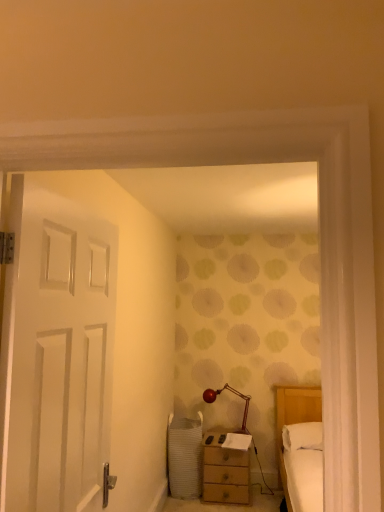
Where is `white matte door at left`? The height and width of the screenshot is (512, 384). white matte door at left is located at coordinates (57, 351).

The width and height of the screenshot is (384, 512). Identify the location of wooden nightstand at lower center. point(225,470).

The width and height of the screenshot is (384, 512). Find the location of `white soft pillow at right`. white soft pillow at right is located at coordinates click(302, 436).

Measure the distance between point [303,444] and camera.

A distance of 3.35 meters exists between point [303,444] and camera.

Where is `white matte door at left`? white matte door at left is located at coordinates (57, 351).

Who is bigger, wooden nightstand at lower center or white matte door at left?

wooden nightstand at lower center is bigger.

Which object is more forward, wooden nightstand at lower center or white matte door at left?

Positioned in front is white matte door at left.

Considering the sizes of objects wooden nightstand at lower center and white matte door at left in the image provided, who is taller, wooden nightstand at lower center or white matte door at left?

With more height is white matte door at left.

Which is closer, (206, 460) or (87, 246)?

Point (206, 460) appears to be farther away from the viewer than point (87, 246).

Is wooden nightstand at lower center to the left of shiny red glass table lamp at center from the viewer's perspective?

Correct, you'll find wooden nightstand at lower center to the left of shiny red glass table lamp at center.

Which is behind, point (212, 493) or point (208, 397)?

The point (208, 397) is farther.

In the scene shown: Does wooden nightstand at lower center have a greater height compared to shiny red glass table lamp at center?

Yes, wooden nightstand at lower center is taller than shiny red glass table lamp at center.

Are white soft pillow at right and white matte door at left making contact?

No, white soft pillow at right is not touching white matte door at left.

Consider the image. Visually, is white soft pillow at right positioned to the left or to the right of white matte door at left?

In the image, white soft pillow at right appears on the right side of white matte door at left.

The image size is (384, 512). I want to click on door that appears in front of the white soft pillow at right, so click(x=57, y=351).

From the image's perspective, between white matte door at left and shiny red glass table lamp at center, which one is located above?

white matte door at left is shown above in the image.

From a real-world perspective, who is located higher, white matte door at left or shiny red glass table lamp at center?

white matte door at left.

Which is in front, white matte door at left or shiny red glass table lamp at center?

white matte door at left is in front.

Is white matte door at left positioned far away from shiny red glass table lamp at center?

Yes.

From the image's perspective, which object appears higher, white soft pillow at right or wooden nightstand at lower center?

white soft pillow at right is shown above in the image.

From a real-world perspective, is white soft pillow at right physically above wooden nightstand at lower center?

Indeed, from a real-world perspective, white soft pillow at right stands above wooden nightstand at lower center.

Would you say wooden nightstand at lower center is part of white soft pillow at right's contents?

No, wooden nightstand at lower center is not inside white soft pillow at right.

Find the location of a particular element. Image resolution: width=384 pixels, height=512 pixels. nightstand below the white soft pillow at right (from a real-world perspective) is located at coordinates (225, 470).

Measure the distance from white matte door at left to wooden nightstand at lower center.

8.22 feet.

Does white matte door at left touch wooden nightstand at lower center?

No, white matte door at left is not making contact with wooden nightstand at lower center.

Is white matte door at left to the right of wooden nightstand at lower center from the viewer's perspective?

Incorrect, white matte door at left is not on the right side of wooden nightstand at lower center.

Considering the relative sizes of shiny red glass table lamp at center and wooden nightstand at lower center in the image provided, is shiny red glass table lamp at center taller than wooden nightstand at lower center?

No.

Looking at this image, is shiny red glass table lamp at center positioned with its back to wooden nightstand at lower center?

shiny red glass table lamp at center is not turned away from wooden nightstand at lower center.

Does shiny red glass table lamp at center appear on the right side of wooden nightstand at lower center?

Correct, you'll find shiny red glass table lamp at center to the right of wooden nightstand at lower center.

Is shiny red glass table lamp at center inside the boundaries of wooden nightstand at lower center, or outside?

shiny red glass table lamp at center lies outside wooden nightstand at lower center.

This screenshot has height=512, width=384. I want to click on nightstand on the right of white matte door at left, so click(x=225, y=470).

The width and height of the screenshot is (384, 512). In the image, there is a wooden nightstand at lower center. In order to click on table lamp above it (from the image's perspective) in this screenshot , I will do `click(235, 394)`.

Considering their positions, is shiny red glass table lamp at center positioned closer to wooden nightstand at lower center than white soft pillow at right?

The object closer to wooden nightstand at lower center is shiny red glass table lamp at center.

From the picture: Considering their positions, is wooden nightstand at lower center positioned further to white matte door at left than shiny red glass table lamp at center?

shiny red glass table lamp at center lies further to white matte door at left than the other object.

Which object lies further to the anchor point white matte door at left, shiny red glass table lamp at center or white soft pillow at right?

shiny red glass table lamp at center lies further to white matte door at left than the other object.

Looking at the image, which one is located further to wooden nightstand at lower center, shiny red glass table lamp at center or white matte door at left?

Based on the image, white matte door at left appears to be further to wooden nightstand at lower center.

Looking at the image, which one is located further to white soft pillow at right, white matte door at left or wooden nightstand at lower center?

The object further to white soft pillow at right is white matte door at left.

From the picture: When comparing their distances from white soft pillow at right, does white matte door at left or shiny red glass table lamp at center seem closer?

The object closer to white soft pillow at right is shiny red glass table lamp at center.

Considering their positions, is white soft pillow at right positioned further to shiny red glass table lamp at center than wooden nightstand at lower center?

white soft pillow at right is positioned further to the anchor shiny red glass table lamp at center.

Considering their positions, is white soft pillow at right positioned further to white matte door at left than wooden nightstand at lower center?

wooden nightstand at lower center is further to white matte door at left.

What are the coordinates of `throw pillow located between white matte door at left and shiny red glass table lamp at center in the depth direction` in the screenshot? It's located at pos(302,436).

At what (x,y) coordinates should I click in order to perform the action: click on table lamp situated between wooden nightstand at lower center and white soft pillow at right from left to right. Please return your answer as a coordinate pair (x, y). Looking at the image, I should click on (235, 394).

The image size is (384, 512). In order to click on nightstand positioned between white matte door at left and shiny red glass table lamp at center from near to far in this screenshot , I will do `click(225, 470)`.

The height and width of the screenshot is (512, 384). Find the location of `throw pillow located between white matte door at left and wooden nightstand at lower center in the depth direction`. throw pillow located between white matte door at left and wooden nightstand at lower center in the depth direction is located at coordinates point(302,436).